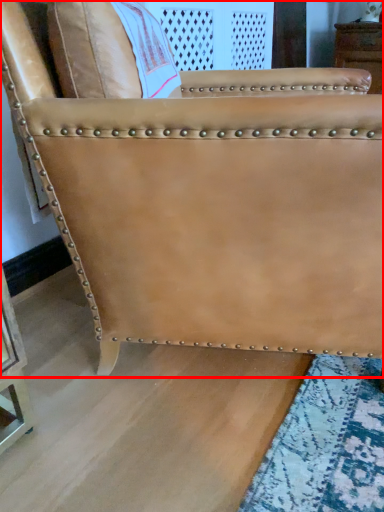
Question: Observing the image, what is the correct spatial positioning of chair (annotated by the red box) in reference to furniture?

Choices:
 (A) left
 (B) right

Answer: (A)